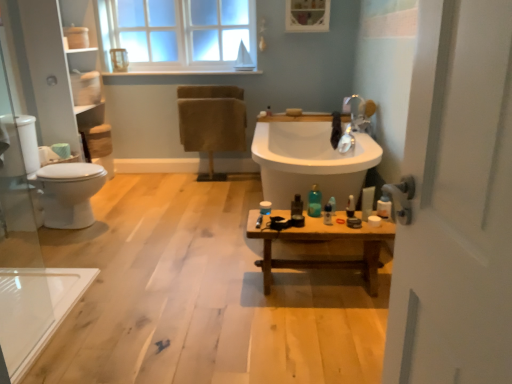
Question: From the image's perspective, is translucent plastic bottle at center, which is the 6th toiletry in right-to-left order, above or below wooden bench at center?

Choices:
 (A) above
 (B) below

Answer: (A)

Question: Do you think translucent plastic bottle at center, which is the 6th toiletry in right-to-left order, is within wooden bench at center, or outside of it?

Choices:
 (A) outside
 (B) inside

Answer: (A)

Question: Based on their relative distances, which object is farther from the translucent plastic bottle at center, which is the 6th toiletry in right-to-left order?

Choices:
 (A) transparent glass door at left
 (B) wooden bench at center
 (C) translucent plastic bottle at right, arranged as the 3th toiletry when viewed from the right
 (D) clear glass window at upper center
 (E) translucent plastic bottle at center, the third toiletry viewed from the left

Answer: (D)

Question: Estimate the real-world distances between objects in this image. Which object is farther from the clear glass window at upper center?

Choices:
 (A) translucent plastic bottle at right, arranged as the 3th toiletry when viewed from the right
 (B) translucent plastic bottle at center, which is the 6th toiletry in right-to-left order
 (C) translucent plastic bottle at right, which is the 5th toiletry from left to right
 (D) white matte toilet paper at lower left
 (E) wooden bench at center

Answer: (D)